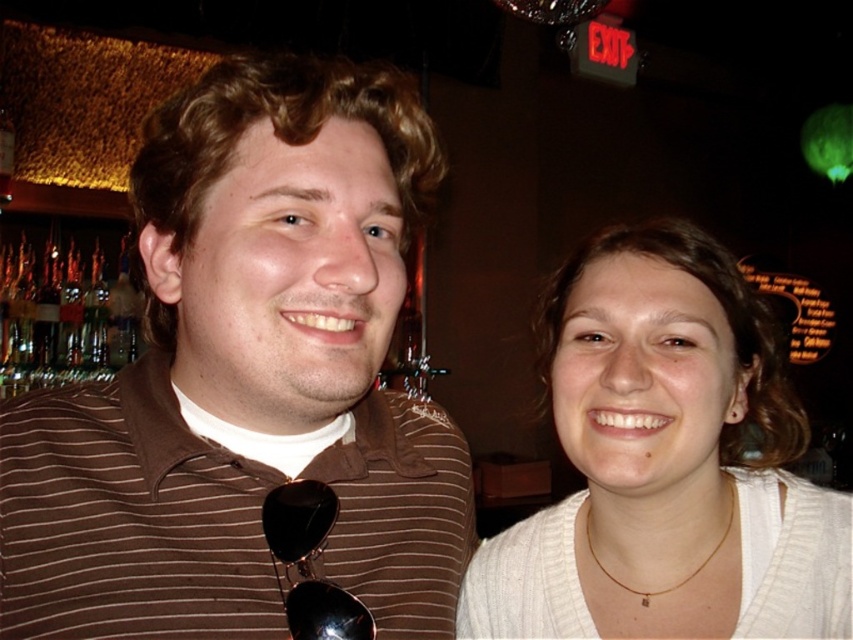
Does brown striped shirt at left lie behind white knitwear at right?

No, it is in front of white knitwear at right.

Image resolution: width=853 pixels, height=640 pixels. In order to click on brown striped shirt at left in this screenshot , I will do `click(247, 380)`.

This screenshot has height=640, width=853. Identify the location of brown striped shirt at left. (247, 380).